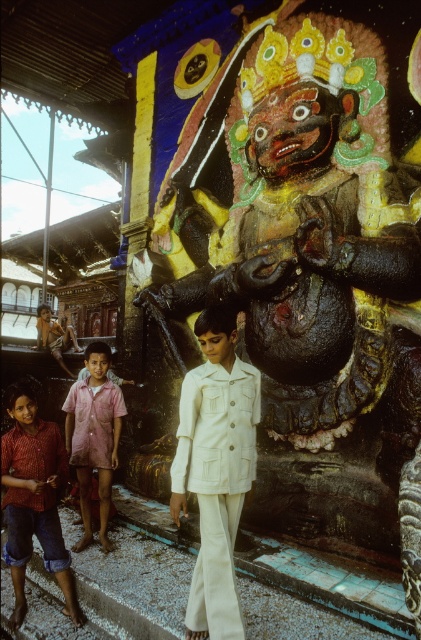
Question: Does polished bronze statue at center have a larger size compared to white cotton trench coat at center?

Choices:
 (A) yes
 (B) no

Answer: (B)

Question: Is white cotton trench coat at center further to camera compared to pink cotton shirt at center?

Choices:
 (A) yes
 (B) no

Answer: (B)

Question: Which object is the farthest from the polished bronze statue at center?

Choices:
 (A) red plaid shirt at lower left
 (B) white cotton trench coat at center
 (C) pink cotton shirt at center

Answer: (B)

Question: Is white cotton trench coat at center above red plaid shirt at lower left?

Choices:
 (A) yes
 (B) no

Answer: (A)

Question: Which of the following is the closest to the observer?

Choices:
 (A) (344, 499)
 (B) (31, 468)

Answer: (B)

Question: Which object is positioned closest to the pink cotton shirt at center?

Choices:
 (A) white cotton trench coat at center
 (B) red plaid shirt at lower left

Answer: (B)